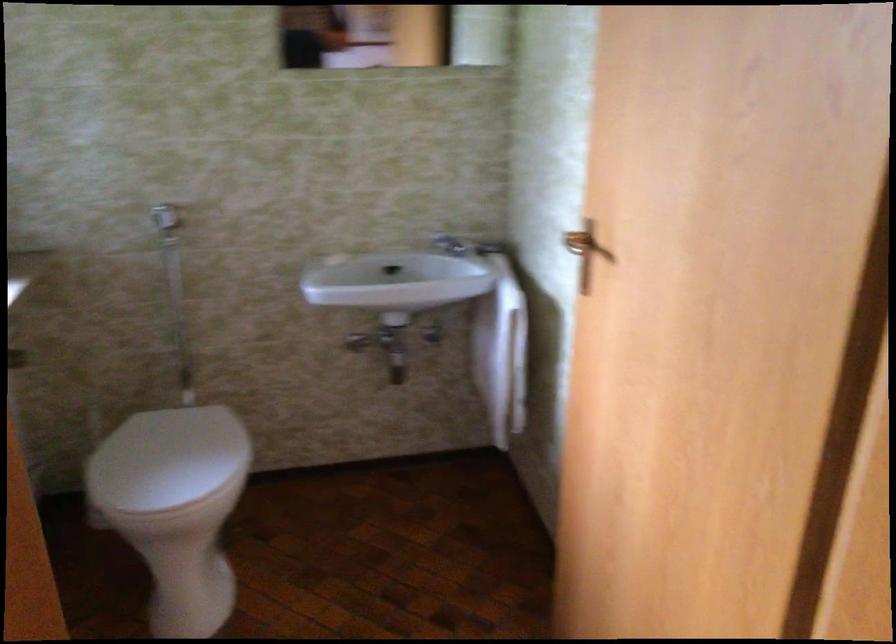
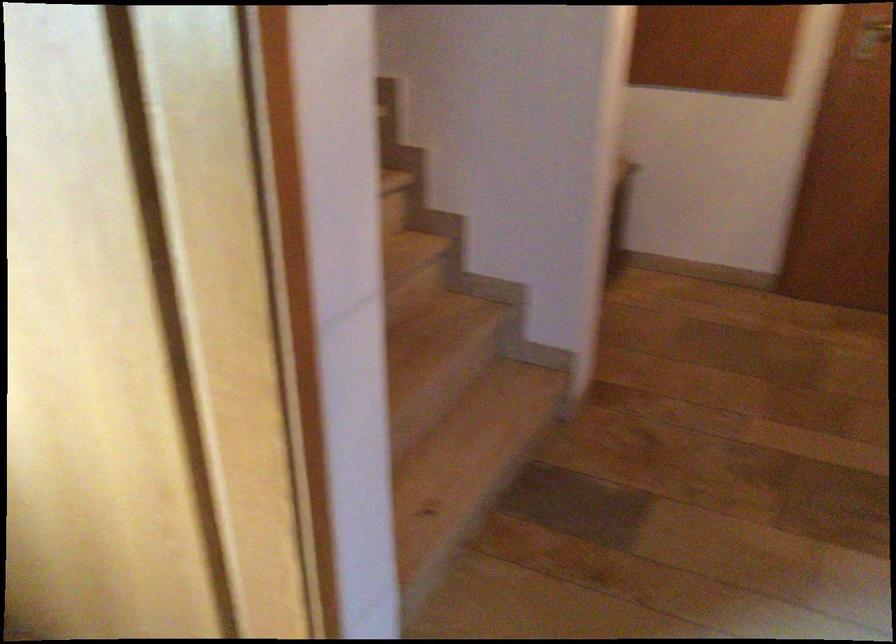
Question: Based on the continuous images, in which direction is the camera rotating? Reply with the corresponding letter.

Choices:
 (A) Left
 (B) Right
 (C) Up
 (D) Down

Answer: (B)